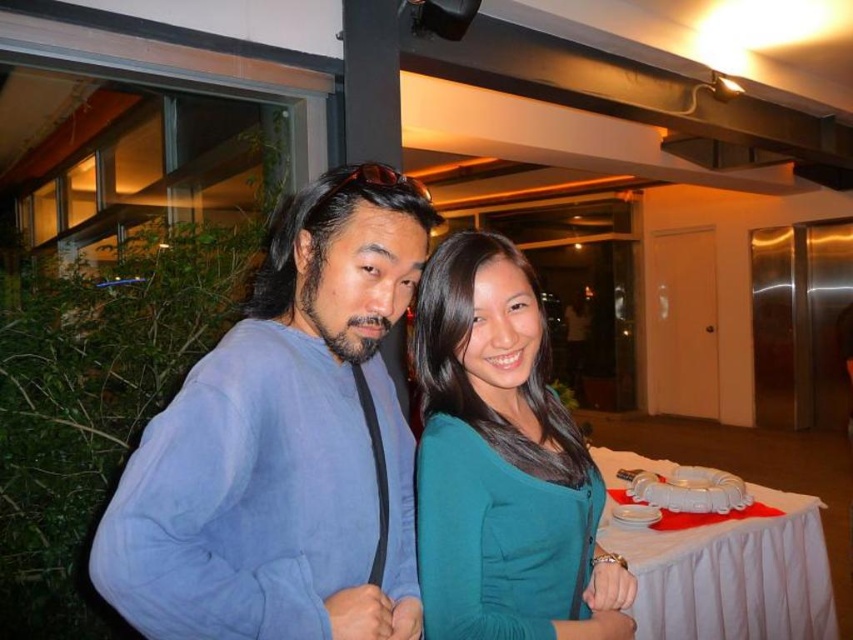
Describe the element at coordinates (283, 444) in the screenshot. I see `blue fleece jacket at center` at that location.

Who is taller, blue fleece jacket at center or teal matte dress at center?

With more height is teal matte dress at center.

Identify the location of blue fleece jacket at center. The width and height of the screenshot is (853, 640). (283, 444).

Who is higher up, teal matte dress at center or white cloth-covered table at lower right?

teal matte dress at center is higher up.

Which is more to the left, teal matte dress at center or white cloth-covered table at lower right?

From the viewer's perspective, teal matte dress at center appears more on the left side.

Between point (425, 508) and point (790, 627), which one is positioned in front?

Point (425, 508) is more forward.

Find the location of a particular element. This screenshot has width=853, height=640. teal matte dress at center is located at coordinates (502, 465).

Can you confirm if blue fleece jacket at center is positioned to the left of white cloth-covered table at lower right?

Correct, you'll find blue fleece jacket at center to the left of white cloth-covered table at lower right.

Does point (366, 602) come closer to viewer compared to point (790, 499)?

That is True.

Is point (366, 321) farther from viewer compared to point (683, 564)?

That is False.

This screenshot has height=640, width=853. I want to click on blue fleece jacket at center, so click(x=283, y=444).